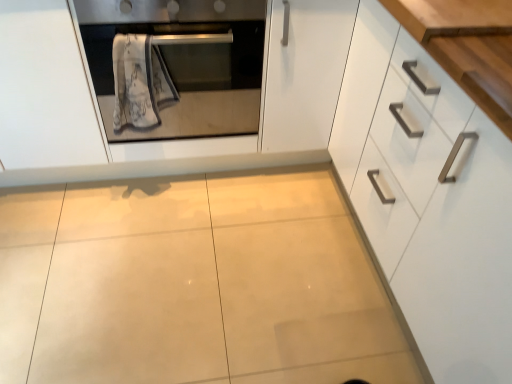
What is the approximate width of wooden at upper right?

The width of wooden at upper right is 43.95 centimeters.

The image size is (512, 384). Describe the element at coordinates (452, 17) in the screenshot. I see `wooden at upper right` at that location.

Locate an element on the screen. The height and width of the screenshot is (384, 512). wooden at upper right is located at coordinates (452, 17).

Considering the relative sizes of wooden at upper right and satin silver oven at upper left in the image provided, is wooden at upper right smaller than satin silver oven at upper left?

Yes.

Locate an element on the screen. This screenshot has height=384, width=512. counter top that appears below the satin silver oven at upper left (from the image's perspective) is located at coordinates (452, 17).

From the image's perspective, which is below, wooden at upper right or satin silver oven at upper left?

wooden at upper right appears lower in the image.

Is white glossy cabinet at right turned away from white textured towel at center?

No, white textured towel at center is not at the back of white glossy cabinet at right.

From the picture: Is white glossy cabinet at right in front of or behind white textured towel at center in the image?

white glossy cabinet at right is in front of white textured towel at center.

From a real-world perspective, is white glossy cabinet at right positioned over white textured towel at center based on gravity?

No, from a real-world perspective, white glossy cabinet at right is not over white textured towel at center

Considering the relative positions of satin silver oven at upper left and white textured towel at center in the image provided, is satin silver oven at upper left to the right of white textured towel at center from the viewer's perspective?

Indeed, satin silver oven at upper left is positioned on the right side of white textured towel at center.

Based on the photo, is satin silver oven at upper left oriented towards white textured towel at center?

Yes, satin silver oven at upper left is turned towards white textured towel at center.

Which point is more distant from viewer, (254, 31) or (163, 67)?

Positioned behind is point (163, 67).

From the picture: How much distance is there between satin silver oven at upper left and white textured towel at center?

satin silver oven at upper left and white textured towel at center are 12.21 centimeters apart.

Which object is more forward, satin silver oven at upper left or wooden at upper right?

wooden at upper right is more forward.

From the image's perspective, would you say satin silver oven at upper left is shown under wooden at upper right?

Actually, satin silver oven at upper left appears above wooden at upper right in the image.

Between point (109, 35) and point (488, 3), which one is positioned behind?

Positioned behind is point (109, 35).

Considering the positions of point (115, 105) and point (173, 112), is point (115, 105) closer or farther from the camera than point (173, 112)?

Point (115, 105) is positioned closer to the camera compared to point (173, 112).

Is white textured towel at center taller or shorter than satin silver oven at upper left?

Clearly, white textured towel at center is shorter compared to satin silver oven at upper left.

From a real-world perspective, does white textured towel at center stand above satin silver oven at upper left?

Yes, from a real-world perspective, white textured towel at center is over satin silver oven at upper left

From the image's perspective, between white textured towel at center and satin silver oven at upper left, which one is located above?

satin silver oven at upper left.

Is wooden at upper right facing towards white glossy cabinet at right?

Yes, wooden at upper right is turned towards white glossy cabinet at right.

Is wooden at upper right bigger or smaller than white glossy cabinet at right?

wooden at upper right is smaller than white glossy cabinet at right.

Is wooden at upper right wider than white glossy cabinet at right?

No, wooden at upper right is not wider than white glossy cabinet at right.

Which is behind, wooden at upper right or white glossy cabinet at right?

wooden at upper right is behind.

Between white textured towel at center and white glossy cabinet at right, which one has larger width?

With larger width is white glossy cabinet at right.

Is white textured towel at center shorter than white glossy cabinet at right?

Indeed, white textured towel at center has a lesser height compared to white glossy cabinet at right.

Does point (117, 98) come farther from viewer compared to point (442, 198)?

Yes, point (117, 98) is behind point (442, 198).

Is white textured towel at center completely or partially outside of white glossy cabinet at right?

white textured towel at center lies outside white glossy cabinet at right's area.

Where is `oven that is above the wooden at upper right (from the image's perspective)`? oven that is above the wooden at upper right (from the image's perspective) is located at coordinates (184, 65).

In the image, there is a white textured towel at center. What are the coordinates of `cabinetry below it (from a real-world perspective)` in the screenshot? It's located at (433, 179).

Based on their spatial positions, is satin silver oven at upper left or white glossy cabinet at right closer to white textured towel at center?

satin silver oven at upper left is closer to white textured towel at center.

From the image, which object appears to be farther from satin silver oven at upper left, wooden at upper right or white textured towel at center?

wooden at upper right.

Based on their spatial positions, is white glossy cabinet at right or satin silver oven at upper left closer to white textured towel at center?

satin silver oven at upper left lies closer to white textured towel at center than the other object.

Which object lies further to the anchor point satin silver oven at upper left, wooden at upper right or white glossy cabinet at right?

wooden at upper right is further to satin silver oven at upper left.

Looking at the image, which one is located closer to wooden at upper right, white textured towel at center or satin silver oven at upper left?

satin silver oven at upper left lies closer to wooden at upper right than the other object.

Looking at this image, considering their positions, is wooden at upper right positioned closer to white textured towel at center than satin silver oven at upper left?

Among the two, satin silver oven at upper left is located nearer to white textured towel at center.

Which object lies nearer to the anchor point wooden at upper right, satin silver oven at upper left or white glossy cabinet at right?

white glossy cabinet at right.

Estimate the real-world distances between objects in this image. Which object is further from wooden at upper right, white glossy cabinet at right or white textured towel at center?

Based on the image, white textured towel at center appears to be further to wooden at upper right.

The height and width of the screenshot is (384, 512). I want to click on counter top between satin silver oven at upper left and white glossy cabinet at right, so click(452, 17).

This screenshot has height=384, width=512. What are the coordinates of `oven between white textured towel at center and white glossy cabinet at right` in the screenshot? It's located at (184, 65).

I want to click on counter top between white textured towel at center and white glossy cabinet at right from left to right, so click(x=452, y=17).

This screenshot has width=512, height=384. Identify the location of oven between white textured towel at center and wooden at upper right. (184, 65).